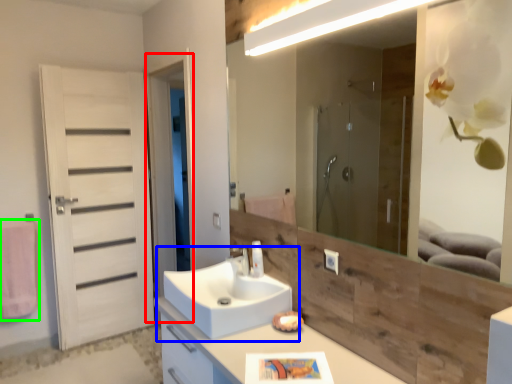
Question: Which object is positioned farthest from screen door (highlighted by a red box)? Select from sink (highlighted by a blue box) and bath towel (highlighted by a green box).

Choices:
 (A) sink
 (B) bath towel

Answer: (A)